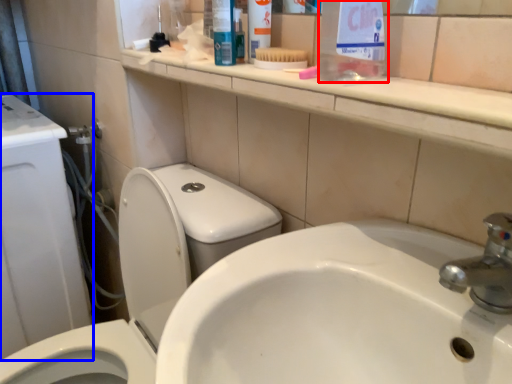
Question: Which object is further to the camera taking this photo, cleaning product (highlighted by a red box) or porcelain (highlighted by a blue box)?

Choices:
 (A) cleaning product
 (B) porcelain

Answer: (B)